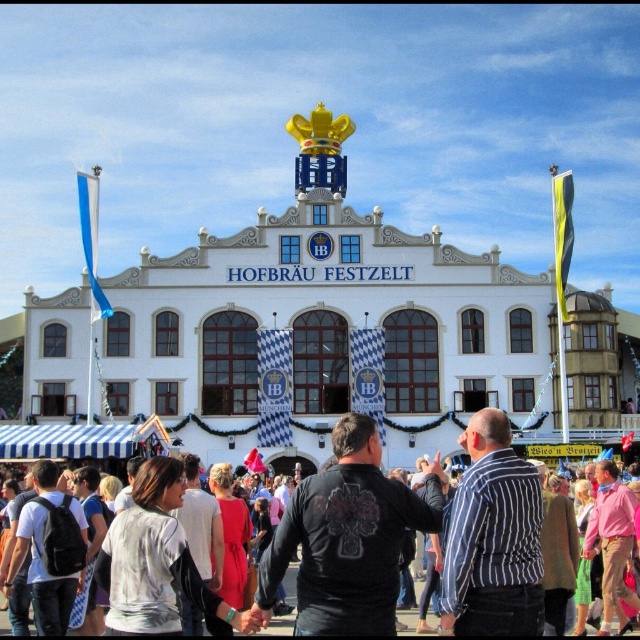
Question: Does black leather jacket at center have a larger size compared to white cotton shirt at center?

Choices:
 (A) yes
 (B) no

Answer: (B)

Question: Is the position of black leather jacket at center more distant than that of white cotton shirt at center?

Choices:
 (A) no
 (B) yes

Answer: (A)

Question: Among these points, which one is farthest from the camera?

Choices:
 (A) (636, 628)
 (B) (429, 504)

Answer: (A)

Question: Among these points, which one is nearest to the camera?

Choices:
 (A) (346, 572)
 (B) (4, 632)

Answer: (A)

Question: Can you confirm if black leather jacket at center is wider than white cotton shirt at center?

Choices:
 (A) yes
 (B) no

Answer: (B)

Question: Which point is closer to the camera?

Choices:
 (A) (1, 579)
 (B) (369, 451)

Answer: (B)